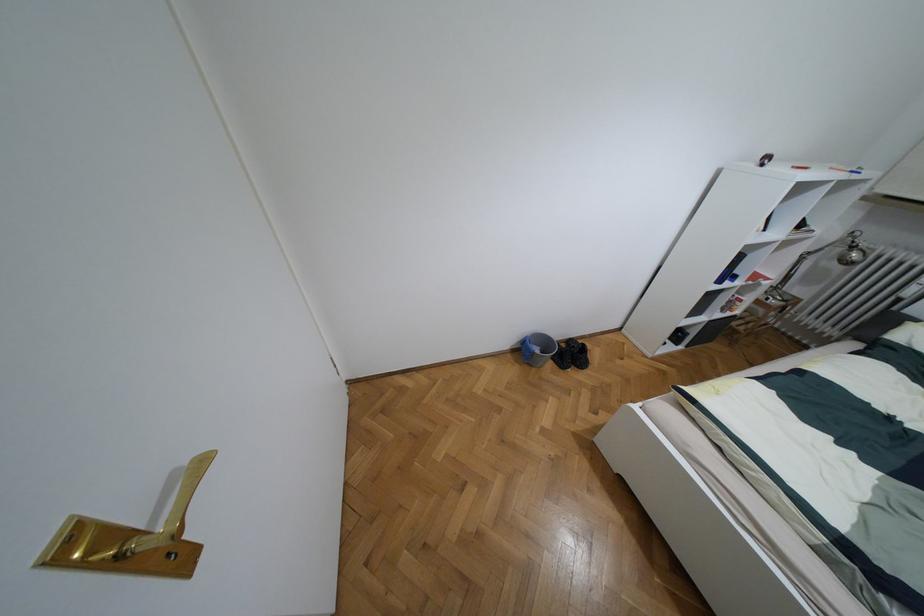
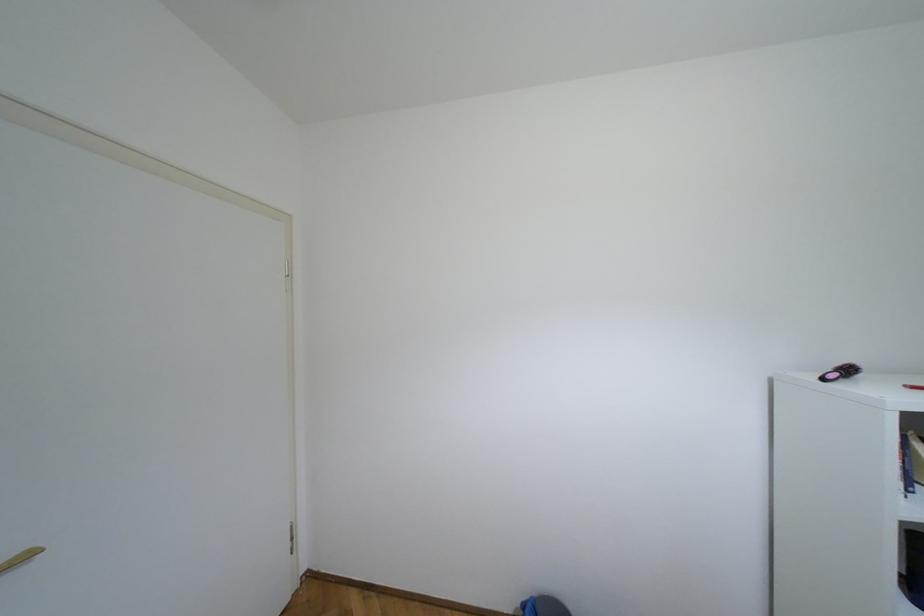
Based on the continuous images, in which direction is the camera rotating?

The rotation direction of the camera is left-up.